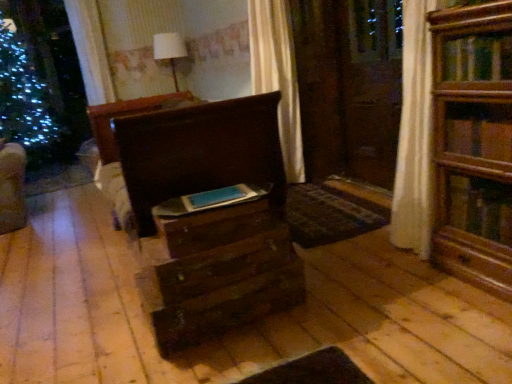
Question: From a real-world perspective, is matte blue book at center physically located above or below wooden drawer at center, which appears as the first drawer when viewed from the top?

Choices:
 (A) below
 (B) above

Answer: (B)

Question: In the image, is matte blue book at center on the left side or the right side of wooden drawer at center, which appears as the first drawer when viewed from the top?

Choices:
 (A) left
 (B) right

Answer: (B)

Question: Which of these objects is positioned closest to the wooden drawer at center, which appears as the first drawer when viewed from the top?

Choices:
 (A) dark wood chest of drawers at center
 (B) matte blue book at center
 (C) wooden drawer at center, the 2th drawer from the top

Answer: (B)

Question: Based on their relative distances, which object is nearer to the wooden drawer at center, which is the first drawer from bottom to top?

Choices:
 (A) wooden drawer at center, which is counted as the second drawer, starting from the bottom
 (B) dark wood chest of drawers at center
 (C) matte blue book at center

Answer: (B)